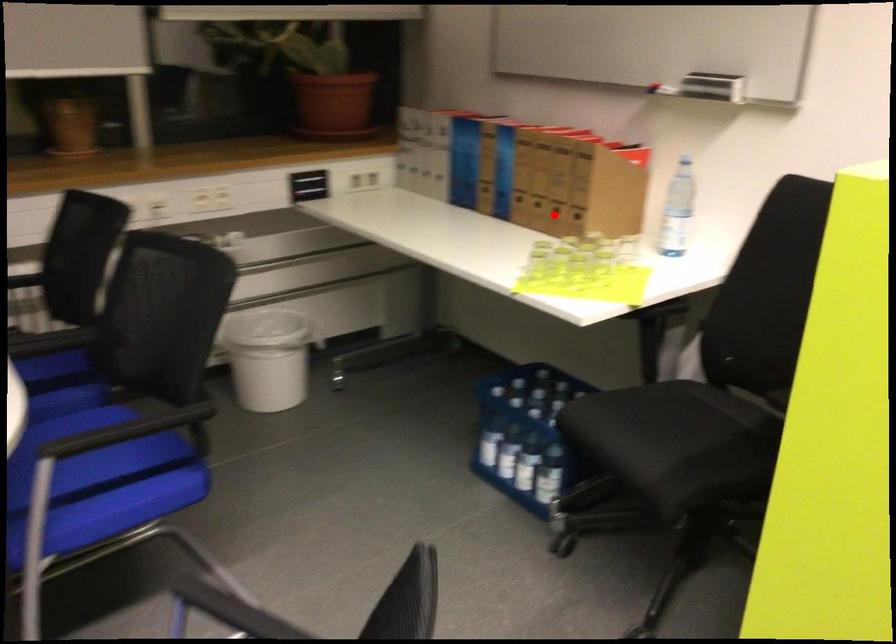
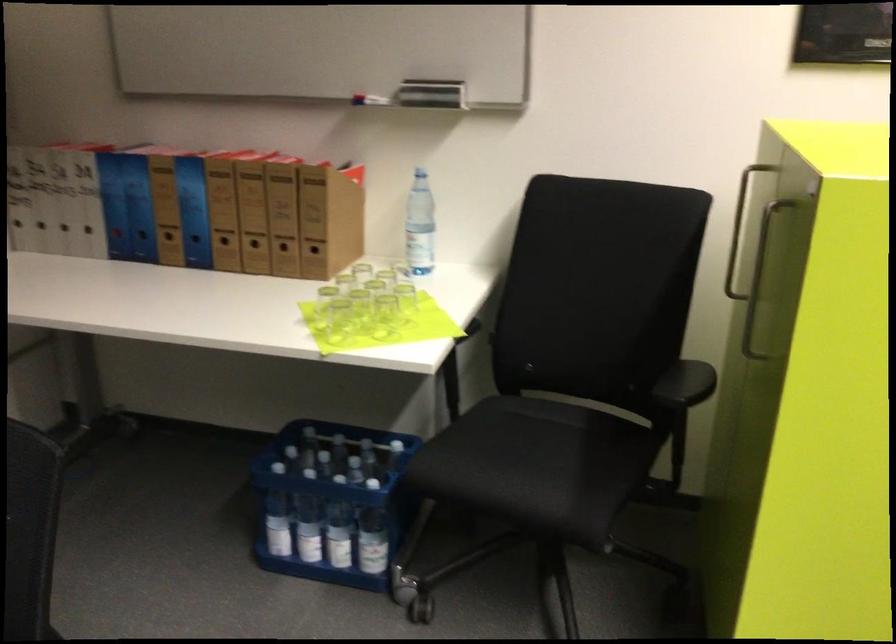
Locate, in the second image, the point that corresponds to the highlighted location in the first image.

(283, 252)